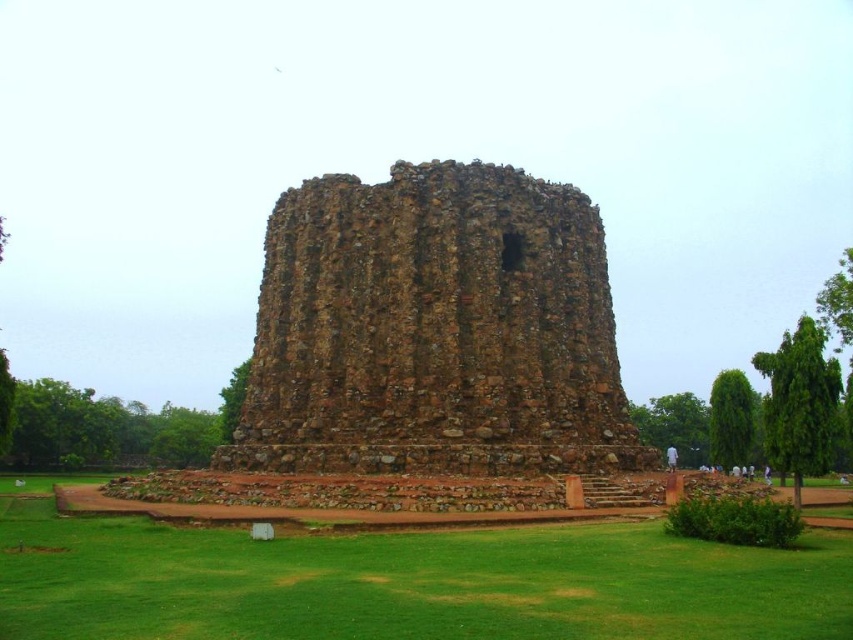
Find the location of a particular element. This screenshot has width=853, height=640. brown stone ruins at center is located at coordinates (434, 330).

Does brown stone ruins at center have a lesser height compared to green grass at center?

In fact, brown stone ruins at center may be taller than green grass at center.

In the scene shown: Measure the distance between point (x=347, y=342) and camera.

Point (x=347, y=342) is 62.41 meters from camera.

Image resolution: width=853 pixels, height=640 pixels. Find the location of `brown stone ruins at center`. brown stone ruins at center is located at coordinates (434, 330).